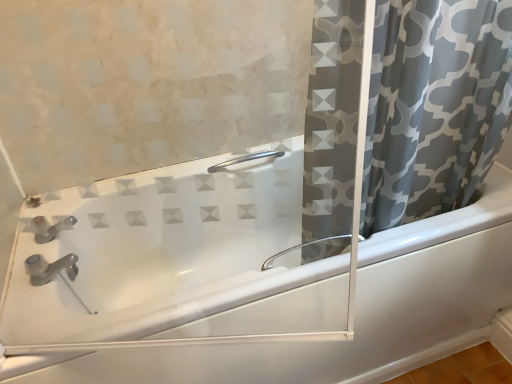
The image size is (512, 384). I want to click on gray printed fabric curtain at right, so click(434, 106).

Identify the location of gray printed fabric curtain at right. (434, 106).

The image size is (512, 384). In the image, there is a gray printed fabric curtain at right. What are the coordinates of `shower below it (from a real-world perspective)` in the screenshot? It's located at (244, 159).

Is satin nickel grab bar at upper center surrounded by gray printed fabric curtain at right?

No, satin nickel grab bar at upper center is not surrounded by gray printed fabric curtain at right.

From a real-world perspective, is gray printed fabric curtain at right on top of satin nickel grab bar at upper center?

Yes, from a real-world perspective, gray printed fabric curtain at right is on top of satin nickel grab bar at upper center.

From the image's perspective, is gray printed fabric curtain at right beneath satin nickel grab bar at upper center?

No, from the image's perspective, gray printed fabric curtain at right is not beneath satin nickel grab bar at upper center.

Which of these two, gray printed fabric curtain at right or white glossy bathtub at center, is smaller?

gray printed fabric curtain at right is smaller.

How different are the orientations of gray printed fabric curtain at right and white glossy bathtub at center in degrees?

gray printed fabric curtain at right and white glossy bathtub at center are facing 0.263 degrees away from each other.

Considering the relative positions of gray printed fabric curtain at right and white glossy bathtub at center in the image provided, is gray printed fabric curtain at right to the right of white glossy bathtub at center from the viewer's perspective?

Yes, gray printed fabric curtain at right is to the right of white glossy bathtub at center.

Does point (435, 134) come farther from viewer compared to point (109, 255)?

No, (435, 134) is closer to viewer.

Is satin nickel faucet at upper left looking in the opposite direction of gray printed fabric curtain at right?

No, satin nickel faucet at upper left is not facing the opposite direction of gray printed fabric curtain at right.

Would you consider satin nickel faucet at upper left to be distant from gray printed fabric curtain at right?

satin nickel faucet at upper left is near gray printed fabric curtain at right, not far away.

Choose the correct answer: Is satin nickel faucet at upper left inside gray printed fabric curtain at right or outside it?

satin nickel faucet at upper left is outside gray printed fabric curtain at right.

From the image's perspective, is satin nickel faucet at upper left located beneath gray printed fabric curtain at right?

Correct, satin nickel faucet at upper left appears lower than gray printed fabric curtain at right in the image.

Which is correct: satin nickel grab bar at upper center is inside white glossy bathtub at center, or outside of it?

satin nickel grab bar at upper center can be found inside white glossy bathtub at center.

Which object is more forward, satin nickel grab bar at upper center or white glossy bathtub at center?

white glossy bathtub at center is more forward.

From a real-world perspective, is satin nickel grab bar at upper center located beneath white glossy bathtub at center?

No, from a real-world perspective, satin nickel grab bar at upper center is not beneath white glossy bathtub at center.

Based on their positions, is white glossy bathtub at center located to the left or right of gray printed fabric curtain at right?

white glossy bathtub at center is to the left of gray printed fabric curtain at right.

Is white glossy bathtub at center surrounding gray printed fabric curtain at right?

No, white glossy bathtub at center does not contain gray printed fabric curtain at right.

At what (x,y) coordinates should I click in order to perform the action: click on bathtub below the gray printed fabric curtain at right (from the image's perspective). Please return your answer as a coordinate pair (x, y). Looking at the image, I should click on (245, 282).

Based on the photo, who is shorter, white glossy bathtub at center or gray printed fabric curtain at right?

With less height is white glossy bathtub at center.

From the image's perspective, which is below, satin nickel faucet at upper left or satin nickel grab bar at upper center?

satin nickel faucet at upper left appears lower in the image.

Considering the sizes of satin nickel faucet at upper left and satin nickel grab bar at upper center in the image, is satin nickel faucet at upper left taller or shorter than satin nickel grab bar at upper center?

Clearly, satin nickel faucet at upper left is taller compared to satin nickel grab bar at upper center.

From a real-world perspective, which object rests below the other?

In real-world perspective, satin nickel grab bar at upper center is lower.

Who is taller, satin nickel grab bar at upper center or gray printed fabric curtain at right?

gray printed fabric curtain at right is taller.

Are satin nickel grab bar at upper center and gray printed fabric curtain at right making contact?

No, satin nickel grab bar at upper center is not with gray printed fabric curtain at right.

Is satin nickel grab bar at upper center behind gray printed fabric curtain at right?

Yes, satin nickel grab bar at upper center is behind gray printed fabric curtain at right.

I want to click on curtain that is on the right side of satin nickel grab bar at upper center, so click(434, 106).

Find the location of a particular element. curtain in front of the white glossy bathtub at center is located at coordinates (434, 106).

From the image, which object appears to be nearer to satin nickel grab bar at upper center, gray printed fabric curtain at right or white glossy bathtub at center?

Based on the image, gray printed fabric curtain at right appears to be nearer to satin nickel grab bar at upper center.

Looking at this image, from the image, which object appears to be nearer to satin nickel faucet at upper left, gray printed fabric curtain at right or satin nickel grab bar at upper center?

Among the two, satin nickel grab bar at upper center is located nearer to satin nickel faucet at upper left.

Looking at the image, which one is located closer to satin nickel grab bar at upper center, satin nickel faucet at upper left or gray printed fabric curtain at right?

The object closer to satin nickel grab bar at upper center is gray printed fabric curtain at right.

From the image, which object appears to be farther from white glossy bathtub at center, gray printed fabric curtain at right or satin nickel grab bar at upper center?

satin nickel grab bar at upper center is positioned further to the anchor white glossy bathtub at center.

Considering their positions, is satin nickel grab bar at upper center positioned closer to satin nickel faucet at upper left than white glossy bathtub at center?

The object closer to satin nickel faucet at upper left is white glossy bathtub at center.

Based on their spatial positions, is white glossy bathtub at center or gray printed fabric curtain at right further from satin nickel grab bar at upper center?

white glossy bathtub at center lies further to satin nickel grab bar at upper center than the other object.

Which object lies nearer to the anchor point satin nickel grab bar at upper center, satin nickel faucet at upper left or white glossy bathtub at center?

Based on the image, white glossy bathtub at center appears to be nearer to satin nickel grab bar at upper center.

Considering their positions, is gray printed fabric curtain at right positioned closer to satin nickel grab bar at upper center than satin nickel faucet at upper left?

gray printed fabric curtain at right lies closer to satin nickel grab bar at upper center than the other object.

I want to click on sink between white glossy bathtub at center and satin nickel grab bar at upper center in the front-back direction, so click(49, 268).

The image size is (512, 384). Find the location of `bathtub located between satin nickel faucet at upper left and gray printed fabric curtain at right in the left-right direction`. bathtub located between satin nickel faucet at upper left and gray printed fabric curtain at right in the left-right direction is located at coordinates (245, 282).

Find the location of a particular element. shower between satin nickel faucet at upper left and gray printed fabric curtain at right in the horizontal direction is located at coordinates (244, 159).

What are the coordinates of `bathtub between gray printed fabric curtain at right and satin nickel grab bar at upper center from front to back` in the screenshot? It's located at (245, 282).